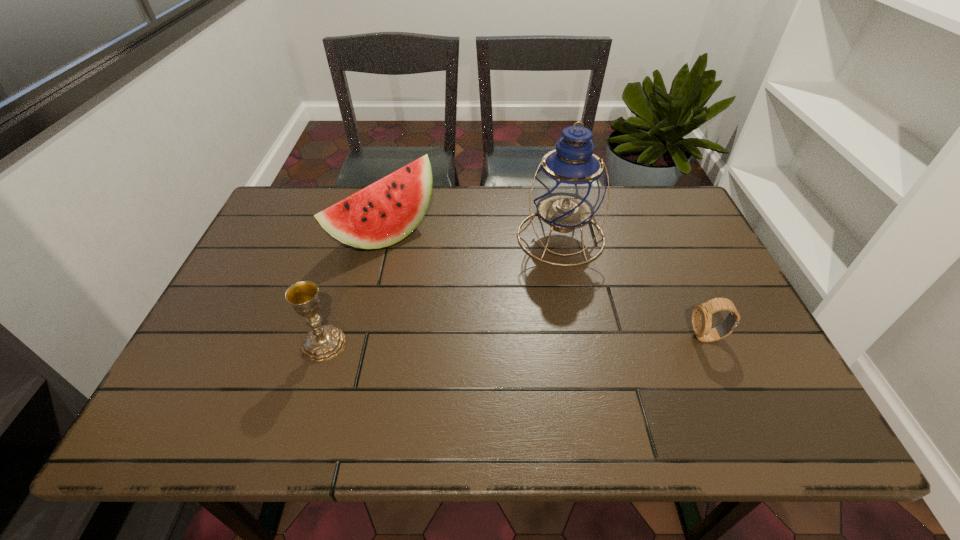
This screenshot has height=540, width=960. I want to click on chalice, so click(x=323, y=343).

You are a GUI agent. You are given a task and a screenshot of the screen. Output one action in this format:
    pyautogui.click(x=<x>, y=<y>)
    Task: Click on the watch
    This screenshot has height=540, width=960.
    Given the screenshot: What is the action you would take?
    pyautogui.click(x=701, y=318)

Locate an element on the screen. The width and height of the screenshot is (960, 540). the shortest object is located at coordinates (701, 318).

The height and width of the screenshot is (540, 960). I want to click on watermelon, so click(385, 212).

You are a GUI agent. You are given a task and a screenshot of the screen. Output one action in this format:
    pyautogui.click(x=<x>, y=<y>)
    Task: Click on the second object from right to left
    The height and width of the screenshot is (540, 960).
    Given the screenshot: What is the action you would take?
    pyautogui.click(x=569, y=187)

The image size is (960, 540). I want to click on the tallest object, so click(569, 187).

In order to click on vacant space located on the back of the chalice in this screenshot , I will do `click(358, 232)`.

Locate an element on the screen. Image resolution: width=960 pixels, height=540 pixels. vacant space located 0.260m on the face of the shortest object is located at coordinates (578, 337).

In order to click on vacant space located 0.150m on the face of the shortest object in this screenshot , I will do (x=625, y=337).

Identify the location of vacant space situated on the face of the shortest object. (517, 337).